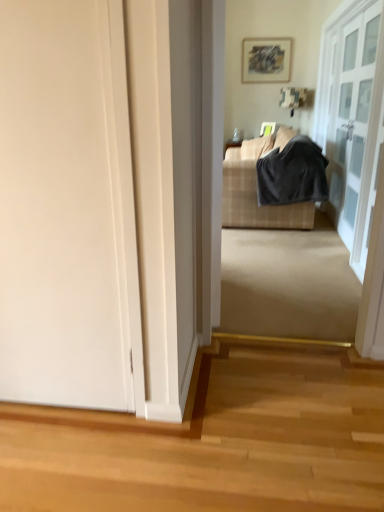
The width and height of the screenshot is (384, 512). What do you see at coordinates (292, 174) in the screenshot?
I see `dark gray fabric at center` at bounding box center [292, 174].

Describe the element at coordinates (352, 118) in the screenshot. I see `clear glass door at upper right, marked as the first door in a right-to-left arrangement` at that location.

Where is `dark gray fabric at center`? Image resolution: width=384 pixels, height=512 pixels. dark gray fabric at center is located at coordinates (292, 174).

At what (x,y) coordinates should I click in order to perform the action: click on door that is below the clear glass door at upper right, the second door positioned from the left (from the image's perspective). Please return your answer as a coordinate pair (x, y). Looking at the image, I should click on (64, 205).

Considering the points (352, 187) and (62, 75), which point is behind, point (352, 187) or point (62, 75)?

Point (352, 187)

Does clear glass door at upper right, which is the first door in back-to-front order, have a lesser width compared to white matte door at left, the first door positioned from the front?

Indeed, clear glass door at upper right, which is the first door in back-to-front order, has a lesser width compared to white matte door at left, the first door positioned from the front.

Considering the relative sizes of clear glass door at upper right, marked as the first door in a right-to-left arrangement, and matte gray picture frame at upper center in the image provided, is clear glass door at upper right, marked as the first door in a right-to-left arrangement, thinner than matte gray picture frame at upper center?

Incorrect, the width of clear glass door at upper right, marked as the first door in a right-to-left arrangement, is not less than that of matte gray picture frame at upper center.

From the picture: How different are the orientations of clear glass door at upper right, marked as the first door in a right-to-left arrangement, and matte gray picture frame at upper center in degrees?

The angle between the facing direction of clear glass door at upper right, marked as the first door in a right-to-left arrangement, and the facing direction of matte gray picture frame at upper center is 90 degrees.

Is clear glass door at upper right, marked as the first door in a right-to-left arrangement, facing towards matte gray picture frame at upper center?

No, clear glass door at upper right, marked as the first door in a right-to-left arrangement, is not facing towards matte gray picture frame at upper center.

Is clear glass door at upper right, which is the first door in back-to-front order, completely or partially outside of matte gray picture frame at upper center?

Yes, clear glass door at upper right, which is the first door in back-to-front order, is outside of matte gray picture frame at upper center.

Which of these two, plaid fabric couch at center or clear glass door at upper right, which appears as the 2th door when viewed from the front, is bigger?

Bigger between the two is plaid fabric couch at center.

From the image's perspective, between plaid fabric couch at center and clear glass door at upper right, the second door positioned from the left, which one is located above?

From the image's view, clear glass door at upper right, the second door positioned from the left, is above.

Is point (252, 169) positioned behind point (355, 178)?

Yes.

Find the location of a particular element. The width and height of the screenshot is (384, 512). studio couch below the clear glass door at upper right, which is the first door in back-to-front order (from the image's perspective) is located at coordinates (274, 182).

Does point (277, 41) come behind point (59, 186)?

Yes, point (277, 41) is behind point (59, 186).

Which is more to the right, matte gray picture frame at upper center or white matte door at left, the first door positioned from the front?

Positioned to the right is matte gray picture frame at upper center.

From the image's perspective, is matte gray picture frame at upper center located above or below white matte door at left, which is counted as the 2th door, starting from the back?

From the image's perspective, matte gray picture frame at upper center appears above white matte door at left, which is counted as the 2th door, starting from the back.

Looking at this image, is plaid fabric couch at center facing towards matte gray picture frame at upper center?

No, plaid fabric couch at center is not aimed at matte gray picture frame at upper center.

From a real-world perspective, who is located higher, plaid fabric couch at center or matte gray picture frame at upper center?

matte gray picture frame at upper center is physically above.

Considering the relative sizes of plaid fabric couch at center and matte gray picture frame at upper center in the image provided, is plaid fabric couch at center taller than matte gray picture frame at upper center?

Yes.

From the image's perspective, who appears lower, plaid fabric couch at center or matte gray picture frame at upper center?

plaid fabric couch at center is shown below in the image.

Who is taller, dark gray fabric at center or white matte door at left, the first door positioned from the front?

white matte door at left, the first door positioned from the front.

The height and width of the screenshot is (512, 384). In the image, there is a dark gray fabric at center. Find the location of `door below it (from the image's perspective)`. door below it (from the image's perspective) is located at coordinates (64, 205).

Is dark gray fabric at center turned away from white matte door at left, placed as the first door when sorted from left to right?

dark gray fabric at center is not turned away from white matte door at left, placed as the first door when sorted from left to right.

From the image's perspective, is white matte door at left, which is counted as the 2th door, starting from the back, beneath clear glass door at upper right, which appears as the 2th door when viewed from the front?

Correct, white matte door at left, which is counted as the 2th door, starting from the back, appears lower than clear glass door at upper right, which appears as the 2th door when viewed from the front, in the image.

Does point (12, 109) come behind point (322, 139)?

No.

Based on the photo, which object is positioned more to the right, white matte door at left, the 2th door in the right-to-left sequence, or clear glass door at upper right, which is the first door in back-to-front order?

clear glass door at upper right, which is the first door in back-to-front order, is more to the right.

In the image, there is a clear glass door at upper right, the second door positioned from the left. Where is `door below it (from a real-world perspective)`? This screenshot has width=384, height=512. door below it (from a real-world perspective) is located at coordinates tap(64, 205).

You are a GUI agent. You are given a task and a screenshot of the screen. Output one action in this format:
    pyautogui.click(x=<x>, y=<y>)
    Task: Click on the 1st door in front of the matte gray picture frame at upper center
    
    Given the screenshot: What is the action you would take?
    pyautogui.click(x=352, y=118)

Based on their spatial positions, is matte gray picture frame at upper center or plaid fabric couch at center closer to dark gray fabric at center?

The object closer to dark gray fabric at center is plaid fabric couch at center.

From the image, which object appears to be nearer to dark gray fabric at center, clear glass door at upper right, the second door positioned from the left, or plaid fabric couch at center?

plaid fabric couch at center is closer to dark gray fabric at center.

In the scene shown: From the image, which object appears to be farther from matte gray picture frame at upper center, clear glass door at upper right, which appears as the 2th door when viewed from the front, or plaid fabric couch at center?

plaid fabric couch at center lies further to matte gray picture frame at upper center than the other object.

From the image, which object appears to be nearer to dark gray fabric at center, white matte door at left, the first door positioned from the front, or plaid fabric couch at center?

plaid fabric couch at center lies closer to dark gray fabric at center than the other object.

Based on their spatial positions, is dark gray fabric at center or white matte door at left, placed as the first door when sorted from left to right, further from matte gray picture frame at upper center?

The object further to matte gray picture frame at upper center is white matte door at left, placed as the first door when sorted from left to right.

When comparing their distances from matte gray picture frame at upper center, does white matte door at left, placed as the first door when sorted from left to right, or clear glass door at upper right, the second door positioned from the left, seem closer?

clear glass door at upper right, the second door positioned from the left, is closer to matte gray picture frame at upper center.

Based on their spatial positions, is matte gray picture frame at upper center or dark gray fabric at center further from clear glass door at upper right, marked as the first door in a right-to-left arrangement?

Based on the image, matte gray picture frame at upper center appears to be further to clear glass door at upper right, marked as the first door in a right-to-left arrangement.

Based on their spatial positions, is dark gray fabric at center or clear glass door at upper right, which appears as the 2th door when viewed from the front, closer to plaid fabric couch at center?

dark gray fabric at center.

The height and width of the screenshot is (512, 384). Find the location of `studio couch that lies between matte gray picture frame at upper center and dark gray fabric at center from top to bottom`. studio couch that lies between matte gray picture frame at upper center and dark gray fabric at center from top to bottom is located at coordinates (274, 182).

Image resolution: width=384 pixels, height=512 pixels. I want to click on studio couch positioned between clear glass door at upper right, which appears as the 2th door when viewed from the front, and matte gray picture frame at upper center from near to far, so click(x=274, y=182).

Locate an element on the screen. Image resolution: width=384 pixels, height=512 pixels. door between white matte door at left, the first door positioned from the front, and plaid fabric couch at center in the front-back direction is located at coordinates (352, 118).

Locate an element on the screen. blanket between white matte door at left, the first door positioned from the front, and matte gray picture frame at upper center from front to back is located at coordinates (292, 174).